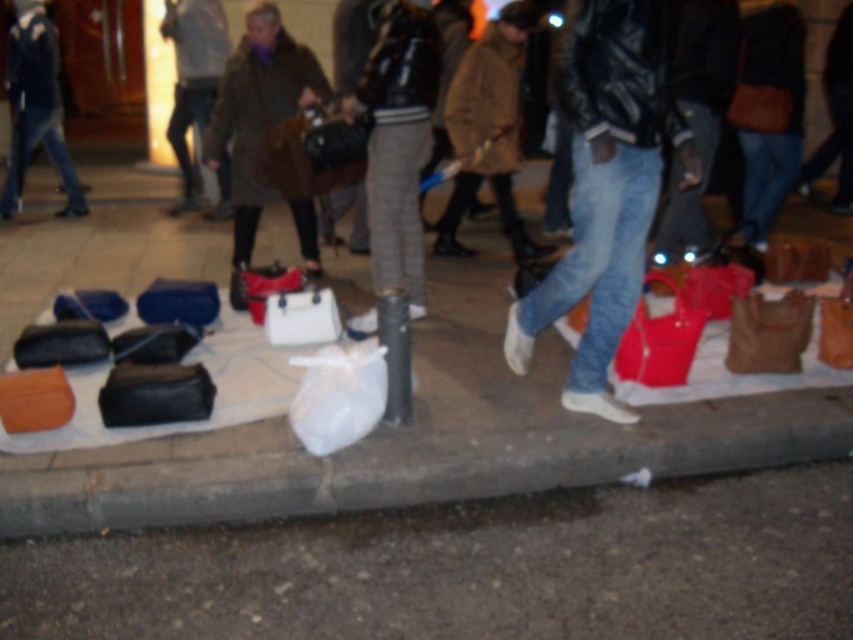
Question: Does leather coat at center appear under shiny red handbag at lower right?

Choices:
 (A) no
 (B) yes

Answer: (A)

Question: Which point appears farthest from the camera in this image?

Choices:
 (A) (630, 356)
 (B) (265, 120)
 (C) (285, 548)

Answer: (B)

Question: Is the position of gray wool pants at center more distant than that of brown leather coat at center?

Choices:
 (A) yes
 (B) no

Answer: (B)

Question: Based on their relative distances, which object is farther from the gray wool pants at center?

Choices:
 (A) matte black jacket at upper left
 (B) shiny red handbag at lower right

Answer: (A)

Question: Which object is farther from the camera taking this photo?

Choices:
 (A) brown leather coat at center
 (B) matte black jacket at center
 (C) matte black jacket at upper left

Answer: (B)

Question: Does white plastic bag at lower center appear under black matte pole at center?

Choices:
 (A) yes
 (B) no

Answer: (A)